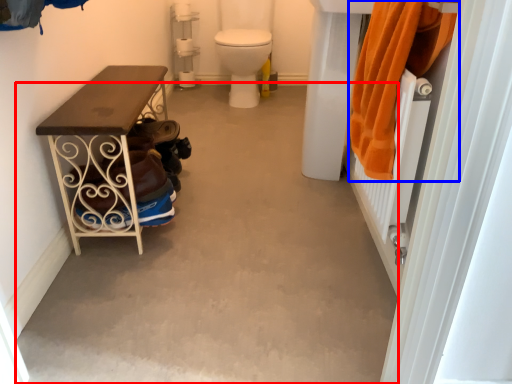
Question: Which of the following is the closest to the observer, concrete (highlighted by a red box) or clothing (highlighted by a blue box)?

Choices:
 (A) concrete
 (B) clothing

Answer: (B)